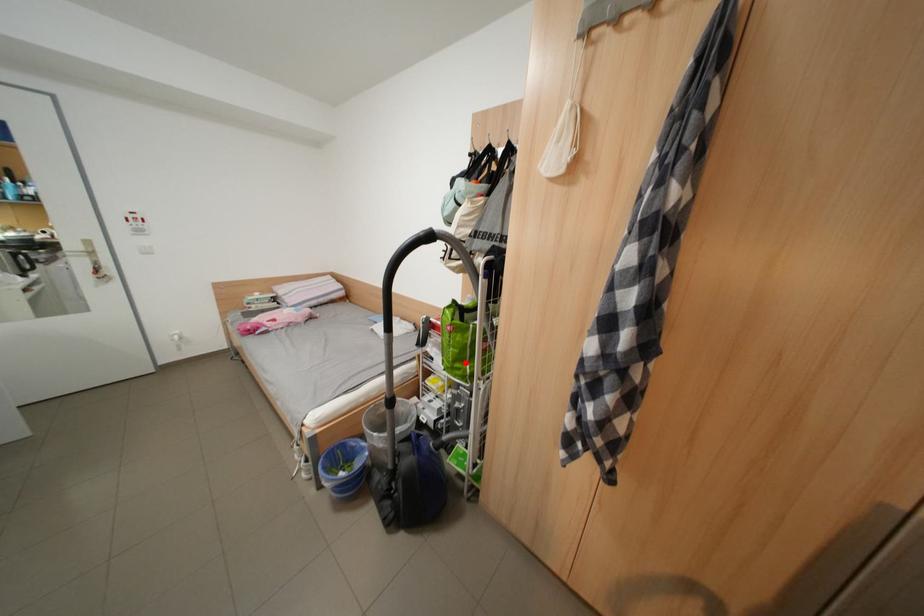
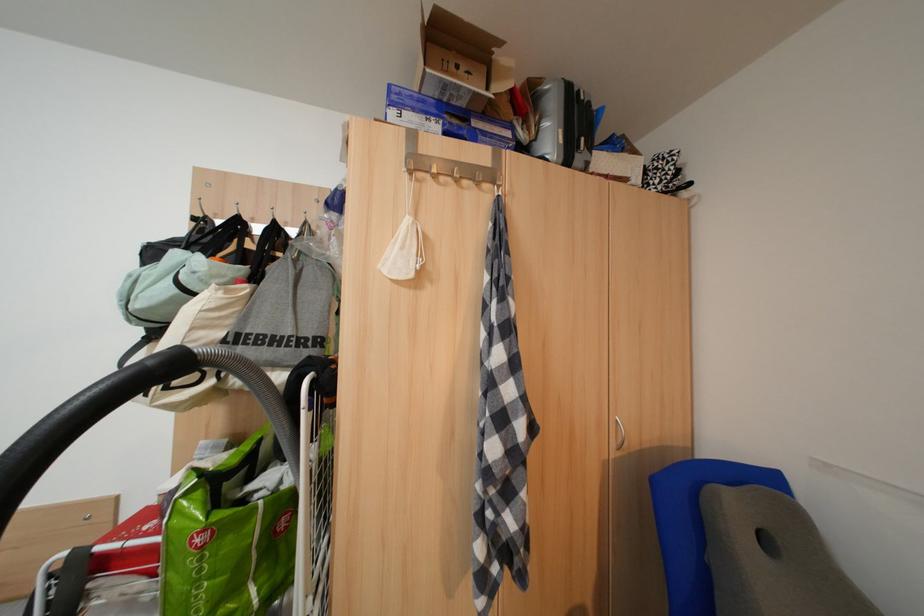
Locate, in the second image, the point that corresponds to the highlighted location in the first image.

(225, 610)